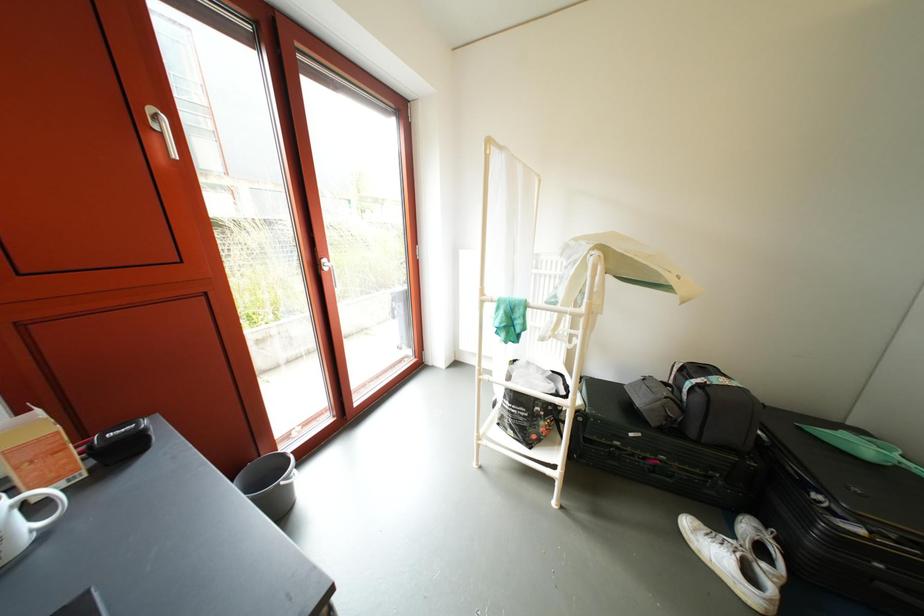
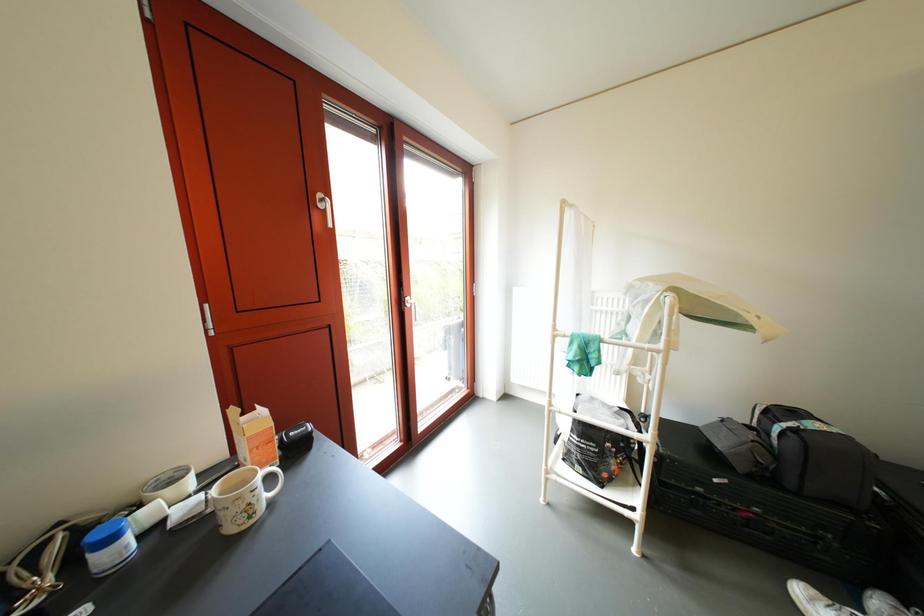
In a continuous first-person perspective shot, in which direction is the camera moving?

The cameraman walked toward left, backward.